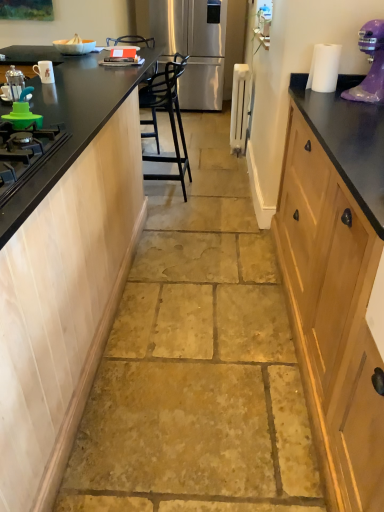
Question: Relative to white paper at upper right, is black matte countertop at left in front or behind?

Choices:
 (A) behind
 (B) front

Answer: (A)

Question: Considering the positions of black matte countertop at left and white paper at upper right in the image, is black matte countertop at left bigger or smaller than white paper at upper right?

Choices:
 (A) small
 (B) big

Answer: (B)

Question: Which of these objects is positioned farthest from the white metallic radiator at center, the 1th appliance in the back-to-front sequence?

Choices:
 (A) purple plastic stand mixer at upper right
 (B) brushed metal coffee press at left
 (C) stainless steel refrigerator at center
 (D) white glossy mug at upper left, the first appliance from the front
 (E) white paper at upper right

Answer: (B)

Question: Based on their relative distances, which object is nearer to the purple plastic stand mixer at upper right?

Choices:
 (A) white paper at upper right
 (B) black matte gas stove at left
 (C) white glossy mug at upper left, the 1th appliance in the left-to-right sequence
 (D) white metallic radiator at center, the second appliance viewed from the front
 (E) black matte countertop at left

Answer: (A)